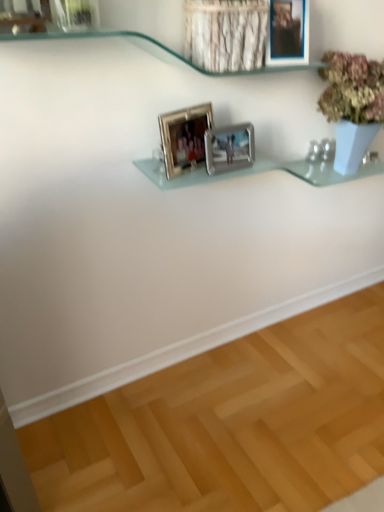
Question: Is silver metallic photo frame at center, which appears as the third picture frame when viewed from the right, positioned with its back to metallic silver picture frame at upper center, which is counted as the third picture frame, starting from the left?

Choices:
 (A) yes
 (B) no

Answer: (B)

Question: Is silver metallic photo frame at center, positioned as the 1th picture frame in left-to-right order, thinner than metallic silver picture frame at upper center, which is counted as the third picture frame, starting from the left?

Choices:
 (A) yes
 (B) no

Answer: (A)

Question: Is the surface of silver metallic photo frame at center, positioned as the 1th picture frame in left-to-right order, in direct contact with metallic silver picture frame at upper center, which is counted as the third picture frame, starting from the left?

Choices:
 (A) no
 (B) yes

Answer: (A)

Question: From the image's perspective, is silver metallic photo frame at center, which appears as the third picture frame when viewed from the right, located above metallic silver picture frame at upper center, which ranks as the first picture frame in right-to-left order?

Choices:
 (A) yes
 (B) no

Answer: (B)

Question: Would you say silver metallic photo frame at center, positioned as the 1th picture frame in left-to-right order, contains metallic silver picture frame at upper center, which is counted as the third picture frame, starting from the left?

Choices:
 (A) no
 (B) yes

Answer: (A)

Question: Considering their positions, is silver metallic photo frame at center, which appears as the third picture frame when viewed from the right, located in front of or behind clear glass shelf at upper center?

Choices:
 (A) behind
 (B) front

Answer: (A)

Question: From the image's perspective, is silver metallic photo frame at center, which appears as the third picture frame when viewed from the right, positioned above or below clear glass shelf at upper center?

Choices:
 (A) above
 (B) below

Answer: (B)

Question: From a real-world perspective, relative to clear glass shelf at upper center, is silver metallic photo frame at center, positioned as the 1th picture frame in left-to-right order, vertically above or below?

Choices:
 (A) above
 (B) below

Answer: (B)

Question: Based on their sizes in the image, would you say silver metallic photo frame at center, which appears as the third picture frame when viewed from the right, is bigger or smaller than clear glass shelf at upper center?

Choices:
 (A) big
 (B) small

Answer: (B)

Question: From a real-world perspective, is metallic silver picture frame at upper center, which is counted as the third picture frame, starting from the left, physically located above or below silver metallic photo frame at center, which appears as the third picture frame when viewed from the right?

Choices:
 (A) below
 (B) above

Answer: (B)

Question: Visually, is metallic silver picture frame at upper center, which ranks as the first picture frame in right-to-left order, positioned to the left or to the right of silver metallic photo frame at center, positioned as the 1th picture frame in left-to-right order?

Choices:
 (A) left
 (B) right

Answer: (B)

Question: Is metallic silver picture frame at upper center, which ranks as the first picture frame in right-to-left order, in front of or behind silver metallic photo frame at center, which appears as the third picture frame when viewed from the right, in the image?

Choices:
 (A) behind
 (B) front

Answer: (B)

Question: Is point (269, 33) positioned closer to the camera than point (198, 141)?

Choices:
 (A) closer
 (B) farther

Answer: (A)

Question: From a real-world perspective, is silver metallic photo frame at center, which appears as the third picture frame when viewed from the right, above or below silver metallic photo frame at center, marked as the second picture frame in a right-to-left arrangement?

Choices:
 (A) below
 (B) above

Answer: (B)

Question: Based on their sizes in the image, would you say silver metallic photo frame at center, positioned as the 1th picture frame in left-to-right order, is bigger or smaller than silver metallic photo frame at center, which appears as the 2th picture frame when viewed from the left?

Choices:
 (A) small
 (B) big

Answer: (B)